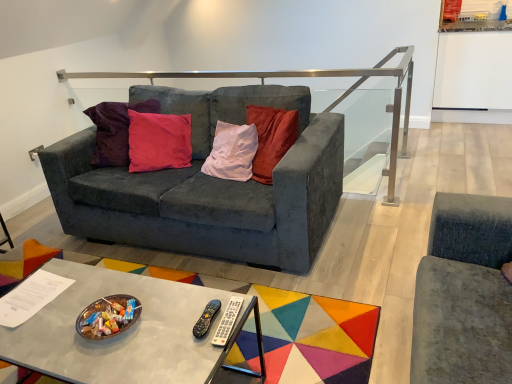
The image size is (512, 384). I want to click on free space to the left of black plastic remote at center, which is the 1th remote from left to right, so click(156, 325).